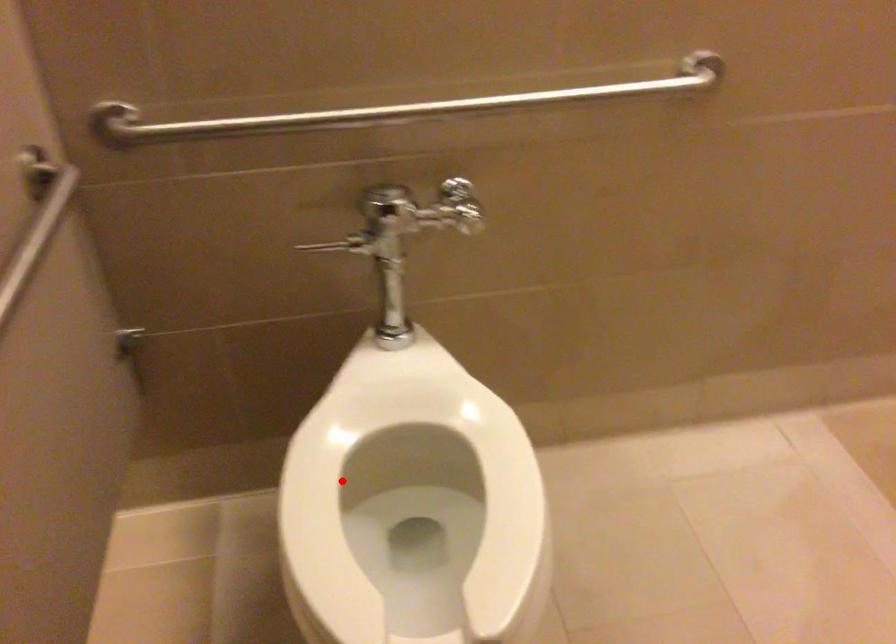
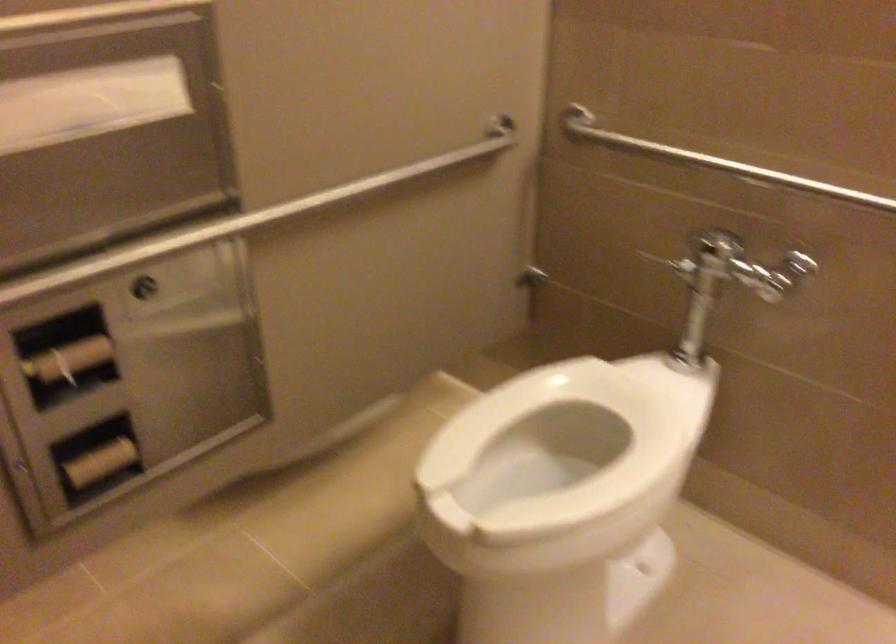
The point at the highlighted location is marked in the first image. Where is the corresponding point in the second image?

(563, 431)